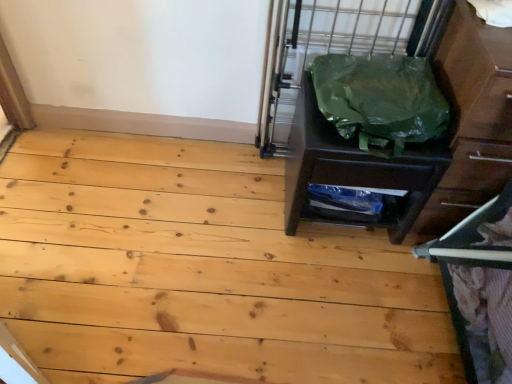
Question: Can you confirm if green plastic bag at right is taller than metallic gray bunk bed at right?

Choices:
 (A) yes
 (B) no

Answer: (B)

Question: Are green plastic bag at right and metallic gray bunk bed at right beside each other?

Choices:
 (A) yes
 (B) no

Answer: (B)

Question: Does green plastic bag at right have a lesser width compared to metallic gray bunk bed at right?

Choices:
 (A) yes
 (B) no

Answer: (B)

Question: Is the depth of green plastic bag at right less than that of metallic gray bunk bed at right?

Choices:
 (A) yes
 (B) no

Answer: (B)

Question: Is green plastic bag at right not close to metallic gray bunk bed at right?

Choices:
 (A) yes
 (B) no

Answer: (B)

Question: Relative to metallic gray bunk bed at right, is green plastic bag at right in front or behind?

Choices:
 (A) behind
 (B) front

Answer: (A)

Question: Considering the relative positions of green plastic bag at right and metallic gray bunk bed at right in the image provided, is green plastic bag at right to the left or to the right of metallic gray bunk bed at right?

Choices:
 (A) left
 (B) right

Answer: (A)

Question: Considering the positions of point (474, 41) and point (508, 339), is point (474, 41) closer or farther from the camera than point (508, 339)?

Choices:
 (A) closer
 (B) farther

Answer: (B)

Question: Is green plastic bag at right wider or thinner than metallic gray bunk bed at right?

Choices:
 (A) wide
 (B) thin

Answer: (A)

Question: Considering the positions of point (331, 357) and point (482, 94), is point (331, 357) closer or farther from the camera than point (482, 94)?

Choices:
 (A) farther
 (B) closer

Answer: (A)

Question: From a real-world perspective, relative to green plastic bag at right, is natural wood floor at center vertically above or below?

Choices:
 (A) above
 (B) below

Answer: (B)

Question: Choose the correct answer: Is natural wood floor at center inside green plastic bag at right or outside it?

Choices:
 (A) inside
 (B) outside

Answer: (B)

Question: Visually, is natural wood floor at center positioned to the left or to the right of green plastic bag at right?

Choices:
 (A) left
 (B) right

Answer: (A)

Question: Is matte brown dresser at right to the left or to the right of natural wood floor at center in the image?

Choices:
 (A) left
 (B) right

Answer: (B)

Question: Is matte brown dresser at right taller or shorter than natural wood floor at center?

Choices:
 (A) tall
 (B) short

Answer: (A)